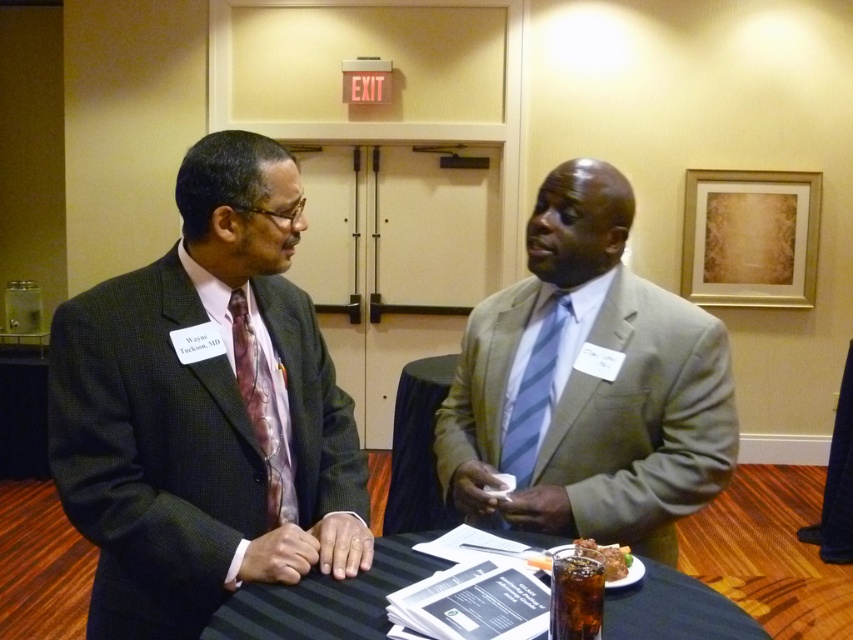
You are organizing a photo shoot and need to ensure that all items on the table are visible in the frame. Given the presence of the matte black suit at left and the brown crispy chicken at center, which object might you need to adjust to avoid blocking the view of the other?

The matte black suit at left has a larger size compared to brown crispy chicken at center, so adjusting the position of the matte black suit at left might be necessary to prevent it from overshadowing the brown crispy chicken at center.

You are organizing a seating arrangement for an event and need to ensure that the light gray suit at center and the black fabric table at center are placed appropriately. Given their sizes, which object should be positioned first to accommodate the other?

The light gray suit at center has a larger size compared to the black fabric table at center. Therefore, the black fabric table at center should be positioned first to allow enough space for the larger light gray suit at center.

You are a photographer standing at the camera position. You need to take a closeup photo of the matte black suit at left without moving the subject. Can you do it with your current position?

The matte black suit at left is 3.88 feet away from camera, so yes, you can take a closeup photo of the matte black suit at left from your current position since the distance is within the camera focus range.